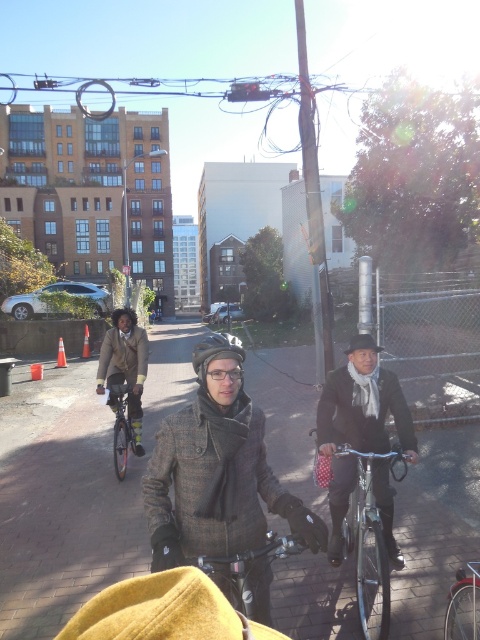
Question: Which point appears closest to the camera in this image?

Choices:
 (A) (256, 580)
 (B) (264, 572)
 (C) (468, 600)

Answer: (A)

Question: Which point is closer to the camera?

Choices:
 (A) (336, 522)
 (B) (111, 323)
 (C) (119, 424)
 (D) (205, 557)

Answer: (D)

Question: Can you confirm if matte gray coat at center is positioned to the left of black matte bicycle helmet at upper left?

Choices:
 (A) yes
 (B) no

Answer: (B)

Question: Is the position of shiny black bicycle at center more distant than that of shiny silver bicycle at center?

Choices:
 (A) no
 (B) yes

Answer: (A)

Question: Which point appears farthest from the camera in this image?

Choices:
 (A) (121, 312)
 (B) (118, 392)
 (C) (248, 605)
 (D) (116, 349)

Answer: (D)

Question: Can you confirm if black matte bicycle at center is positioned to the right of black matte bicycle helmet at upper left?

Choices:
 (A) yes
 (B) no

Answer: (A)